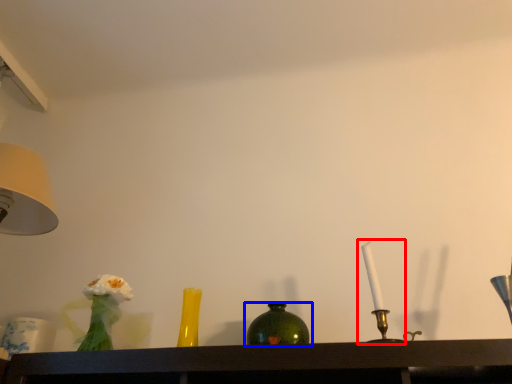
Question: Which object appears closest to the camera in this image, candle holder (highlighted by a red box) or bottle (highlighted by a blue box)?

Choices:
 (A) candle holder
 (B) bottle

Answer: (A)